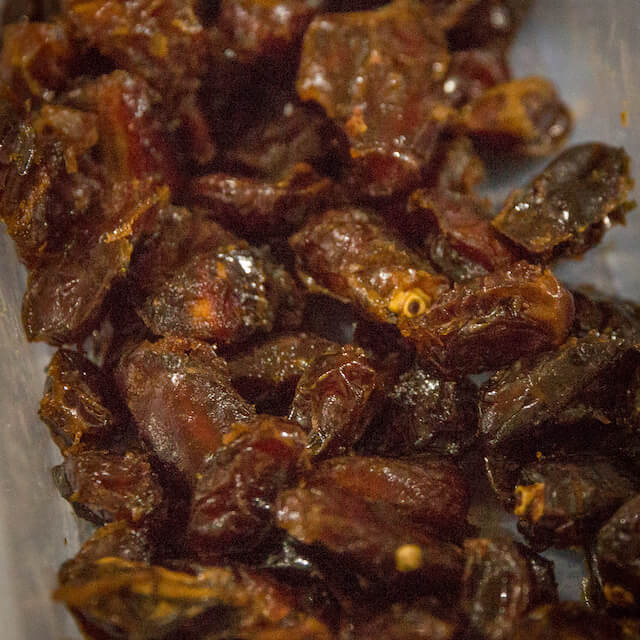
Find the location of a particular element. The width and height of the screenshot is (640, 640). plate is located at coordinates (591, 61).